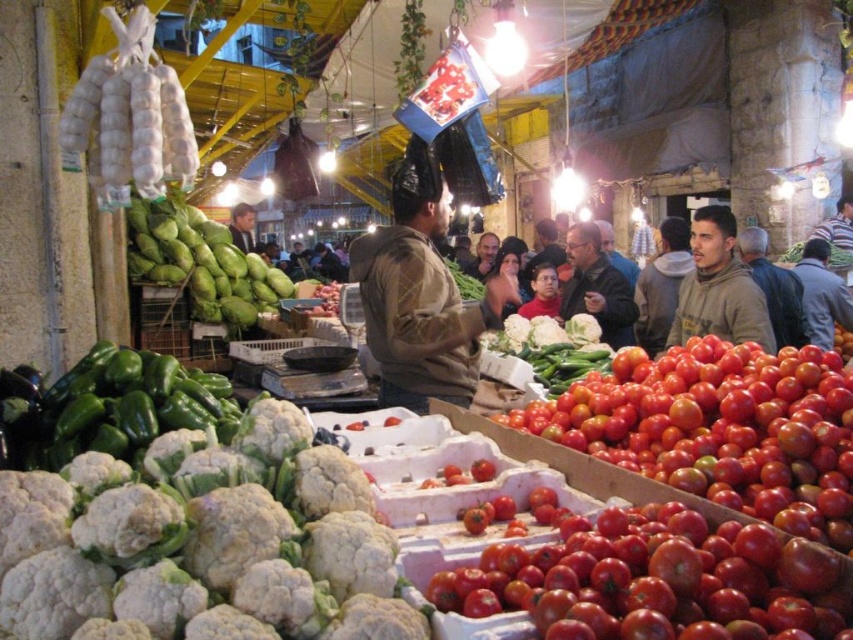
Question: Can you confirm if brown leather jacket at center is wider than smooth brown jacket at center?

Choices:
 (A) no
 (B) yes

Answer: (B)

Question: Is brown fuzzy hoodie at upper right thinner than brown textured hoodie at center?

Choices:
 (A) yes
 (B) no

Answer: (A)

Question: Is brown fuzzy hoodie at upper right bigger than matte brown hoodie at right?

Choices:
 (A) yes
 (B) no

Answer: (B)

Question: Which point is closer to the camera taking this photo?

Choices:
 (A) (21, 404)
 (B) (486, 365)
 (C) (403, 388)

Answer: (A)

Question: Which object is the farthest from the green matte bell pepper at lower left?

Choices:
 (A) brown textured hoodie at center
 (B) smooth brown jacket at center
 (C) brown fuzzy hoodie at upper right
 (D) green matte cabbage at center

Answer: (B)

Question: Among these points, which one is nearest to the camera?

Choices:
 (A) (732, 268)
 (B) (759, 621)

Answer: (B)